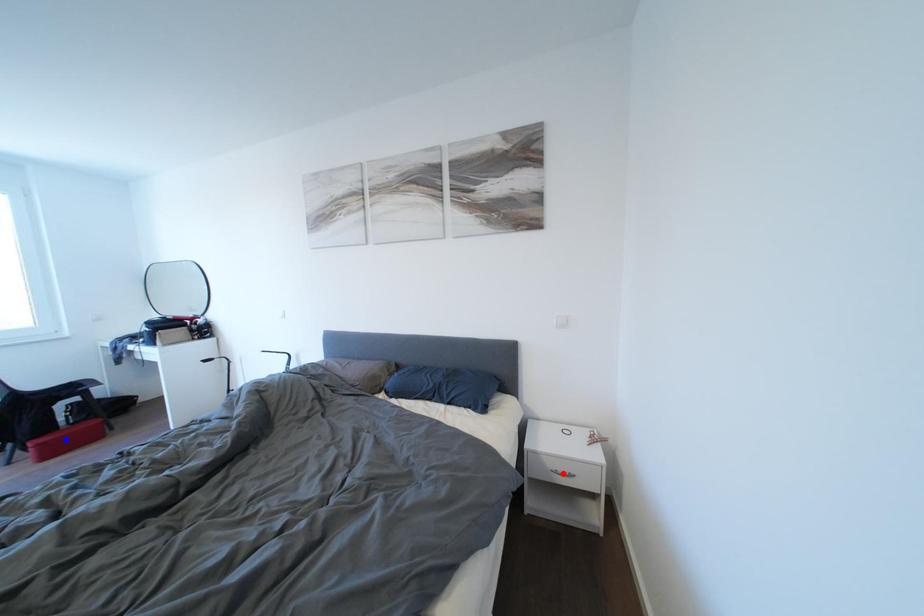
Question: Which of the two points in the image is closer to the camera?

Choices:
 (A) Blue point is closer.
 (B) Red point is closer.

Answer: (B)